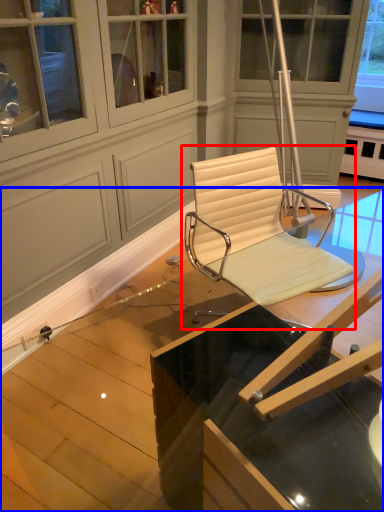
Question: Which object is further to the camera taking this photo, chair (highlighted by a red box) or table (highlighted by a blue box)?

Choices:
 (A) chair
 (B) table

Answer: (A)